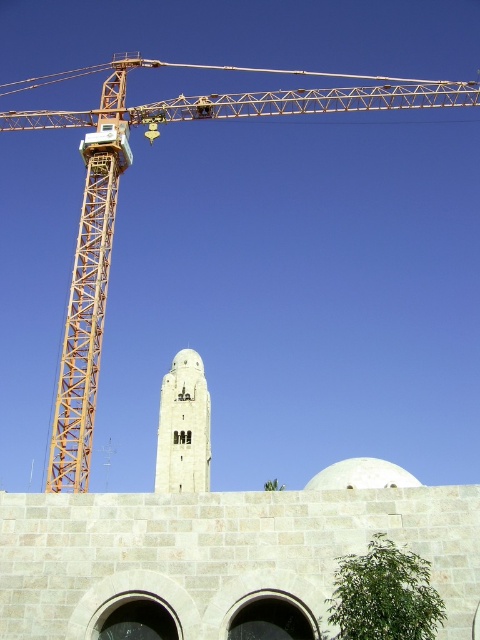
Question: Can you confirm if beige stone wall at lower center is positioned to the left of white stone dome at center?

Choices:
 (A) no
 (B) yes

Answer: (B)

Question: Which point is closer to the camera?

Choices:
 (A) beige stone wall at lower center
 (B) orange metallic crane at left

Answer: (A)

Question: Which of these objects is positioned closest to the white stone dome at center?

Choices:
 (A) beige stone wall at lower center
 (B) light beige stone bell tower at center
 (C) orange metallic crane at left

Answer: (B)

Question: Which object is farther from the camera taking this photo?

Choices:
 (A) beige stone wall at lower center
 (B) white stone dome at center
 (C) light beige stone bell tower at center

Answer: (C)

Question: Is beige stone wall at lower center thinner than orange metallic crane at left?

Choices:
 (A) no
 (B) yes

Answer: (B)

Question: Is beige stone wall at lower center closer to camera compared to light beige stone bell tower at center?

Choices:
 (A) yes
 (B) no

Answer: (A)